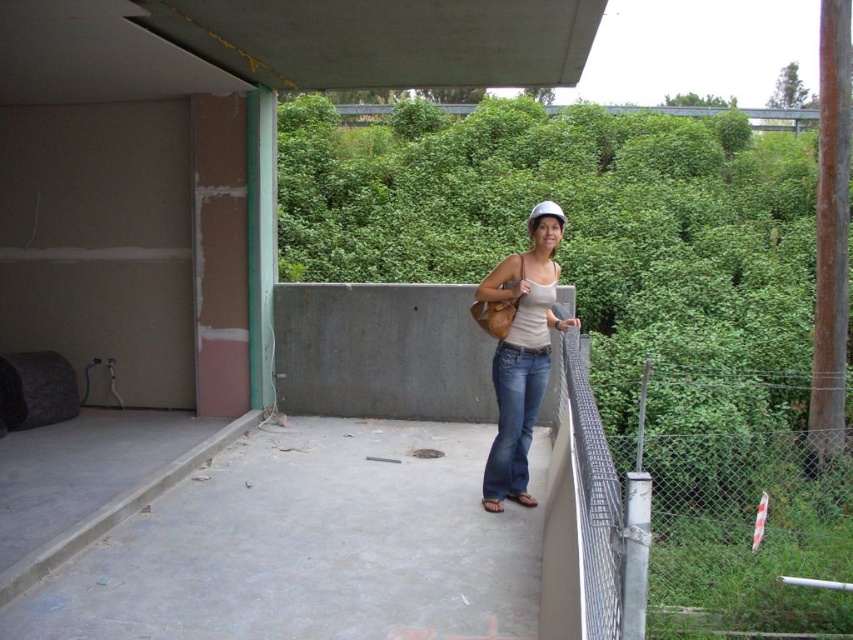
Does wire mesh fence at right lie behind matte white helmet at center?

No, wire mesh fence at right is closer to the viewer.

Which is in front, point (822, 608) or point (575, 323)?

Point (575, 323) is more forward.

Does point (734, 432) come behind point (521, 497)?

Yes.

You are a GUI agent. You are given a task and a screenshot of the screen. Output one action in this format:
    pyautogui.click(x=<x>, y=<y>)
    Task: Click on the wire mesh fence at right
    The width and height of the screenshot is (853, 640).
    Given the screenshot: What is the action you would take?
    pyautogui.click(x=706, y=518)

Measure the distance between point (564, 321) and camera.

14.19 feet

Does point (548, 205) come farther from viewer compared to point (509, 358)?

That is True.

Describe the element at coordinates (519, 349) in the screenshot. I see `matte white helmet at center` at that location.

Locate an element on the screen. The height and width of the screenshot is (640, 853). matte white helmet at center is located at coordinates (519, 349).

Who is higher up, wire mesh fence at right or blue denim jeans at center?

blue denim jeans at center

Is wire mesh fence at right above blue denim jeans at center?

No, wire mesh fence at right is not above blue denim jeans at center.

The height and width of the screenshot is (640, 853). Describe the element at coordinates (706, 518) in the screenshot. I see `wire mesh fence at right` at that location.

What are the coordinates of `wire mesh fence at right` in the screenshot? It's located at (706, 518).